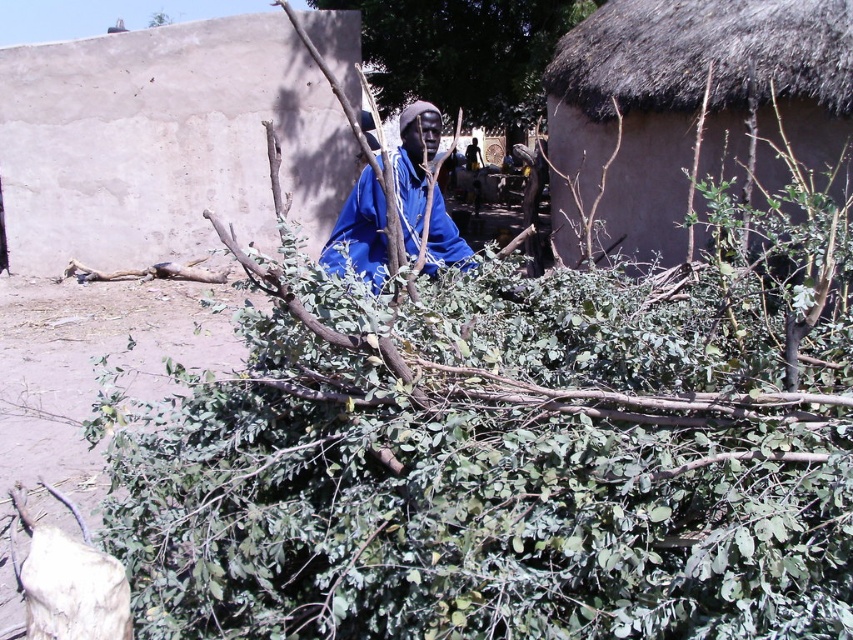
You are a visitor in this village and need to determine which object occupies more horizontal space in the scene. Based on the green leafy bush at center and the blue matte robe at center, which one is wider?

The green leafy bush at center is wider than the blue matte robe at center according to the description provided.

You are standing in the rural village scene and want to take a photo of the entire pile of green foliage and branches. Which point, point (451, 0) or point (363, 179), is closer to your camera to ensure the foliage pile is in focus?

Point (363, 179) is closer to the camera, so focusing on this point would ensure the pile of green foliage and branches is in focus.

You are a visitor in this village and want to see the man in the blue matte robe at center. However, there is a green leafy bush at center blocking your view. Can you see the man clearly?

The green leafy bush at center is positioned over blue matte robe at center, so the bush is blocking the view of the man in the blue matte robe at center. You cannot see him clearly.